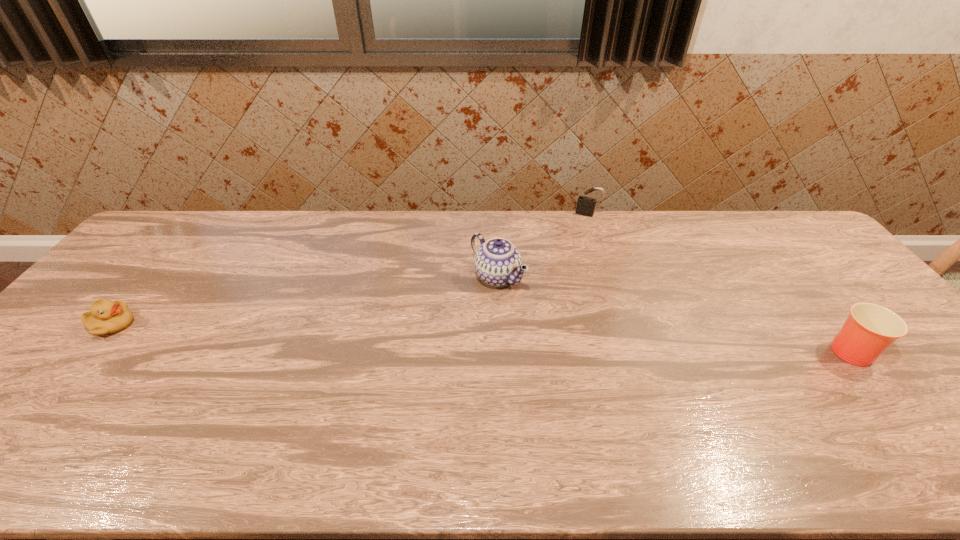
Locate an element on the screen. The height and width of the screenshot is (540, 960). vacant space at the far left corner is located at coordinates (158, 237).

Where is `unoccupied area between the padlock and the chinaware`? This screenshot has width=960, height=540. unoccupied area between the padlock and the chinaware is located at coordinates (542, 246).

Identify the location of free space that is in between the third object from right to left and the padlock. The height and width of the screenshot is (540, 960). (542, 246).

The image size is (960, 540). In order to click on vacant space that's between the chinaware and the padlock in this screenshot , I will do `click(542, 246)`.

This screenshot has width=960, height=540. I want to click on empty location between the cup and the farthest object, so click(717, 281).

Image resolution: width=960 pixels, height=540 pixels. Identify the location of free point between the shortest object and the padlock. (350, 269).

You are a GUI agent. You are given a task and a screenshot of the screen. Output one action in this format:
    pyautogui.click(x=<x>, y=<y>)
    Task: Click on the vacant space in between the second object from left to right and the padlock
    
    Given the screenshot: What is the action you would take?
    pyautogui.click(x=542, y=246)

Locate an element on the screen. The width and height of the screenshot is (960, 540). free spot between the cup and the leftmost object is located at coordinates (480, 336).

You are a GUI agent. You are given a task and a screenshot of the screen. Output one action in this format:
    pyautogui.click(x=<x>, y=<y>)
    Task: Click on the vacant point located between the leftmost object and the rightmost object
    The width and height of the screenshot is (960, 540).
    Given the screenshot: What is the action you would take?
    pyautogui.click(x=480, y=336)

Image resolution: width=960 pixels, height=540 pixels. I want to click on unoccupied position between the cup and the leftmost object, so click(480, 336).